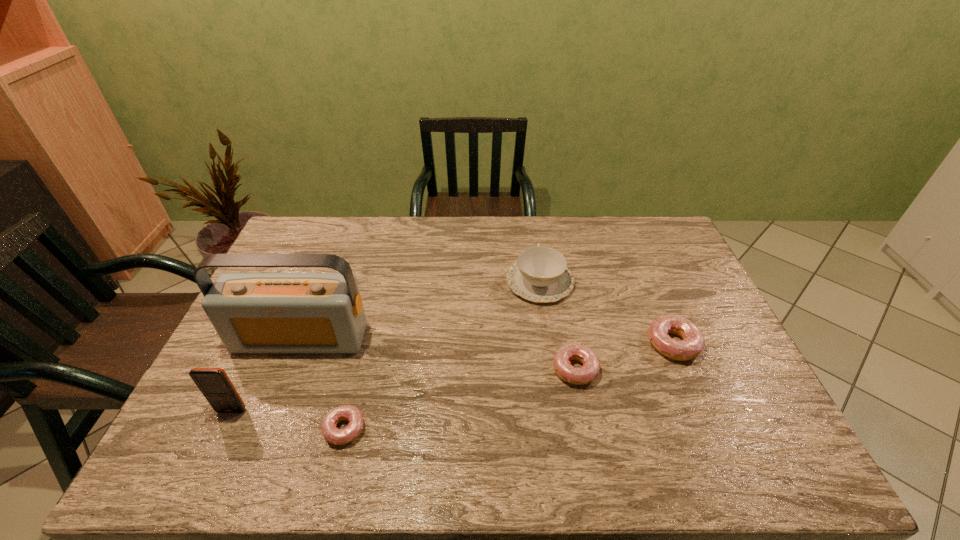
Identify the location of cellular telephone located at the left edge. (215, 385).

This screenshot has height=540, width=960. I want to click on object located at the right edge, so click(x=693, y=342).

Where is `object that is at the near left corner`? object that is at the near left corner is located at coordinates (215, 385).

This screenshot has width=960, height=540. In the image, there is a desktop. Identify the location of vacant space at the far edge. (460, 239).

This screenshot has width=960, height=540. I want to click on vacant region at the near edge, so click(366, 408).

You are a GUI agent. You are given a task and a screenshot of the screen. Output one action in this format:
    pyautogui.click(x=<x>, y=<y>)
    Task: Click on the free region at the right edge of the desktop
    This screenshot has width=960, height=540.
    Given the screenshot: What is the action you would take?
    pyautogui.click(x=649, y=268)

Locate an element on the screen. The width and height of the screenshot is (960, 540). vacant space at the far left corner is located at coordinates (331, 233).

Identify the location of vacant region at the far right corner of the desktop. (626, 227).

What are the coordinates of `vacant point located between the farthest object and the second doughnut from right to left` in the screenshot? It's located at (558, 326).

The width and height of the screenshot is (960, 540). I want to click on empty space between the tallest doughnut and the tallest object, so click(x=487, y=341).